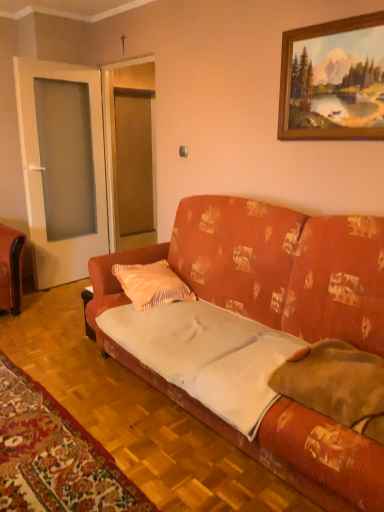
Image resolution: width=384 pixels, height=512 pixels. Describe the element at coordinates (40, 176) in the screenshot. I see `transparent glass door at left` at that location.

What is the approximate height of white cotton sheet at center?

7.08 inches.

This screenshot has width=384, height=512. Describe the element at coordinates (337, 385) in the screenshot. I see `beige fabric pillow at right, the 2th pillow from the back` at that location.

Image resolution: width=384 pixels, height=512 pixels. I want to click on orange velvet pillow at center, the 2th pillow from the front, so click(x=151, y=284).

What is the approximate width of orange velvet pillow at center, which is the first pillow in left-to-right order?

orange velvet pillow at center, which is the first pillow in left-to-right order, is 17.47 inches wide.

What do you see at coordinates (320, 461) in the screenshot? This screenshot has height=512, width=384. I see `textured orange couch at center` at bounding box center [320, 461].

What do you see at coordinates (333, 81) in the screenshot? The image size is (384, 512). I see `wooden picture frame at upper right` at bounding box center [333, 81].

The height and width of the screenshot is (512, 384). In order to click on transparent glass door at left in this screenshot , I will do `click(40, 176)`.

Is white cotton sheet at center located within wooden picture frame at upper right?

No, white cotton sheet at center is located outside of wooden picture frame at upper right.

Who is bigger, wooden picture frame at upper right or white cotton sheet at center?

Bigger between the two is white cotton sheet at center.

Is wooden picture frame at upper right not close to white cotton sheet at center?

Yes.

Is point (308, 418) in front of point (326, 50)?

Yes, it is in front of point (326, 50).

Can wooden picture frame at upper right be found inside textured orange couch at center?

No, wooden picture frame at upper right is not surrounded by textured orange couch at center.

From the picture: Is textured orange couch at center taller or shorter than wooden picture frame at upper right?

In the image, textured orange couch at center appears to be taller than wooden picture frame at upper right.

Find the location of a particular element. The width and height of the screenshot is (384, 512). picture frame behind the textured orange couch at center is located at coordinates pos(333,81).

Is white cotton sheet at center facing away from white fabric mat at lower left?

No, white cotton sheet at center is not facing away from white fabric mat at lower left.

Locate an element on the screen. sheet located on the right of white fabric mat at lower left is located at coordinates (206, 355).

From a real-world perspective, who is located lower, white cotton sheet at center or white fabric mat at lower left?

white fabric mat at lower left is physically lower.

Is white cotton sheet at center at the right side of white fabric mat at lower left?

Yes, white cotton sheet at center is to the right of white fabric mat at lower left.

Between transparent glass door at left and beige fabric pillow at right, positioned as the first pillow in right-to-left order, which one has larger width?

beige fabric pillow at right, positioned as the first pillow in right-to-left order.

Is transparent glass door at left taller than beige fabric pillow at right, placed as the 1th pillow when sorted from front to back?

Indeed, transparent glass door at left has a greater height compared to beige fabric pillow at right, placed as the 1th pillow when sorted from front to back.

How distant is transparent glass door at left from beige fabric pillow at right, arranged as the 2th pillow when viewed from the left?

They are 10.14 feet apart.

How different are the orientations of transparent glass door at left and beige fabric pillow at right, arranged as the 2th pillow when viewed from the left, in degrees?

94.6 degrees.

Is white fabric mat at lower left facing towards textured orange couch at center?

Yes, white fabric mat at lower left is oriented towards textured orange couch at center.

How different are the orientations of white fabric mat at lower left and textured orange couch at center in degrees?

There is a 179-degree angle between the facing directions of white fabric mat at lower left and textured orange couch at center.

Based on the photo, is white fabric mat at lower left at the right side of textured orange couch at center?

No, white fabric mat at lower left is not to the right of textured orange couch at center.

Is white fabric mat at lower left touching transparent glass door at left?

There is a gap between white fabric mat at lower left and transparent glass door at left.

Locate an element on the screen. This screenshot has width=384, height=512. glass door above the white fabric mat at lower left (from the image's perspective) is located at coordinates (40, 176).

Between point (75, 486) and point (84, 260), which one is positioned in front?

The point (75, 486) is closer.

From the image's perspective, is white fabric mat at lower left beneath transparent glass door at left?

Indeed, from the image's perspective, white fabric mat at lower left is shown beneath transparent glass door at left.

Based on their sizes in the image, would you say white cotton sheet at center is bigger or smaller than beige fabric pillow at right, arranged as the 2th pillow when viewed from the left?

Considering their sizes, white cotton sheet at center takes up more space than beige fabric pillow at right, arranged as the 2th pillow when viewed from the left.

Is white cotton sheet at center positioned with its back to beige fabric pillow at right, positioned as the first pillow in right-to-left order?

white cotton sheet at center does not have its back to beige fabric pillow at right, positioned as the first pillow in right-to-left order.

In the scene shown: Which of these two, white cotton sheet at center or beige fabric pillow at right, placed as the 1th pillow when sorted from front to back, stands taller?

beige fabric pillow at right, placed as the 1th pillow when sorted from front to back.

The height and width of the screenshot is (512, 384). Find the location of `sheet in front of the wooden picture frame at upper right`. sheet in front of the wooden picture frame at upper right is located at coordinates (206, 355).

Locate an element on the screen. This screenshot has height=512, width=384. picture frame on the right of the textured orange couch at center is located at coordinates (333, 81).

Estimate the real-world distances between objects in this image. Which object is closer to textured orange couch at center, transparent glass door at left or wooden picture frame at upper right?

Among the two, wooden picture frame at upper right is located nearer to textured orange couch at center.

When comparing their distances from white fabric mat at lower left, does white cotton sheet at center or textured orange couch at center seem closer?

white cotton sheet at center lies closer to white fabric mat at lower left than the other object.

Considering their positions, is wooden picture frame at upper right positioned closer to transparent glass door at left than beige fabric pillow at right, placed as the 1th pillow when sorted from front to back?

Among the two, wooden picture frame at upper right is located nearer to transparent glass door at left.

When comparing their distances from orange velvet pillow at center, the 2th pillow from the front, does white cotton sheet at center or textured orange couch at center seem further?

white cotton sheet at center lies further to orange velvet pillow at center, the 2th pillow from the front, than the other object.

Which object lies nearer to the anchor point wooden picture frame at upper right, orange velvet pillow at center, placed as the 1th pillow when sorted from back to front, or beige fabric pillow at right, placed as the 1th pillow when sorted from front to back?

orange velvet pillow at center, placed as the 1th pillow when sorted from back to front, lies closer to wooden picture frame at upper right than the other object.

Based on their spatial positions, is transparent glass door at left or beige fabric pillow at right, positioned as the first pillow in right-to-left order, further from orange velvet pillow at center, the 2th pillow in the right-to-left sequence?

The object further to orange velvet pillow at center, the 2th pillow in the right-to-left sequence, is transparent glass door at left.

Based on their spatial positions, is white cotton sheet at center or orange velvet pillow at center, the 2th pillow from the front, further from white fabric mat at lower left?

orange velvet pillow at center, the 2th pillow from the front, lies further to white fabric mat at lower left than the other object.

In the scene shown: When comparing their distances from beige fabric pillow at right, the 2th pillow from the back, does white fabric mat at lower left or transparent glass door at left seem further?

transparent glass door at left is positioned further to the anchor beige fabric pillow at right, the 2th pillow from the back.

Identify the location of sheet between white fabric mat at lower left and orange velvet pillow at center, the 2th pillow in the right-to-left sequence, along the z-axis. The height and width of the screenshot is (512, 384). (206, 355).

Find the location of `studio couch between wooden picture frame at upper right and white cotton sheet at center in the up-down direction`. studio couch between wooden picture frame at upper right and white cotton sheet at center in the up-down direction is located at coordinates (320, 461).

Locate an element on the screen. The image size is (384, 512). sheet positioned between beige fabric pillow at right, arranged as the 2th pillow when viewed from the left, and orange velvet pillow at center, placed as the 1th pillow when sorted from back to front, from near to far is located at coordinates (206, 355).

Where is `sheet between wooden picture frame at upper right and white fabric mat at lower left in the up-down direction`? sheet between wooden picture frame at upper right and white fabric mat at lower left in the up-down direction is located at coordinates (206, 355).